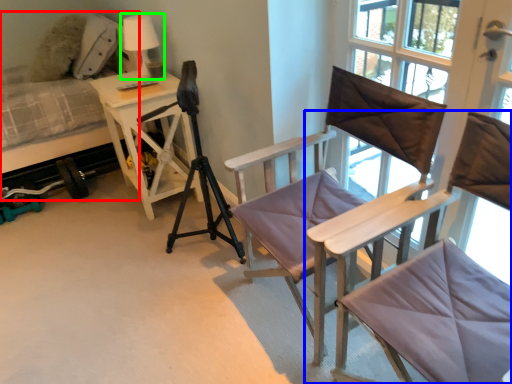
Question: Estimate the real-world distances between objects in this image. Which object is farther from hospital bed (highlighted by a red box), chair (highlighted by a blue box) or table lamp (highlighted by a green box)?

Choices:
 (A) chair
 (B) table lamp

Answer: (A)